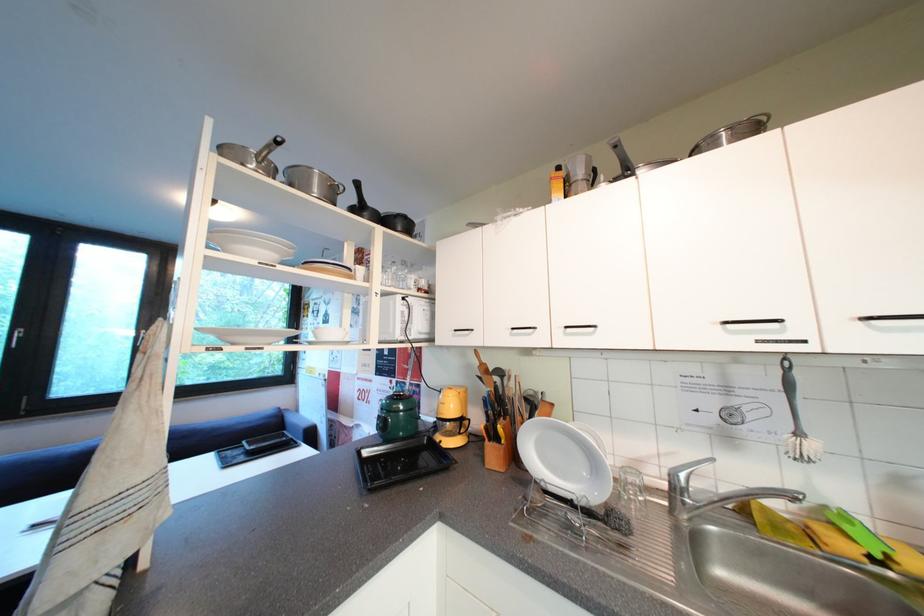
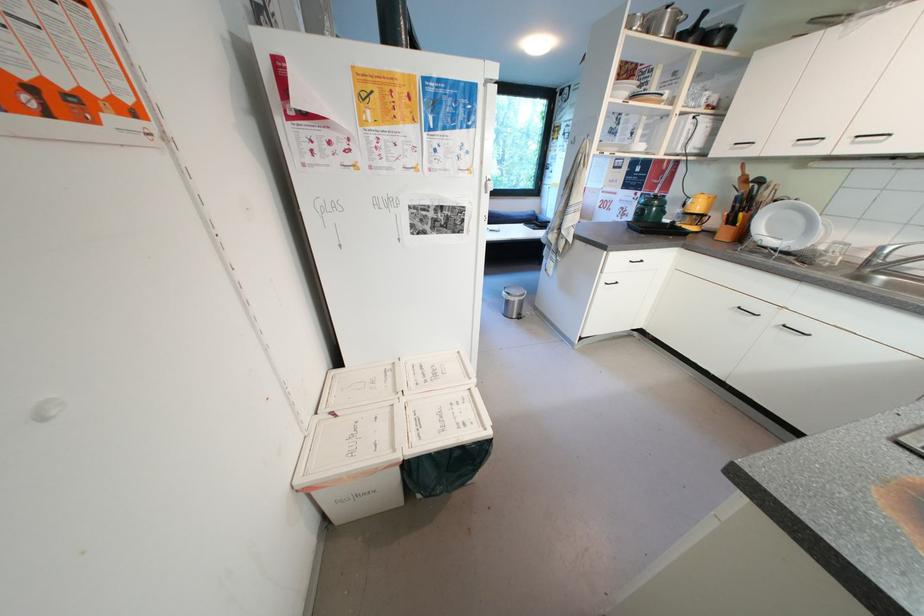
In the second image, find the point that corresponds to pixel 524 459 in the first image.

(749, 238)